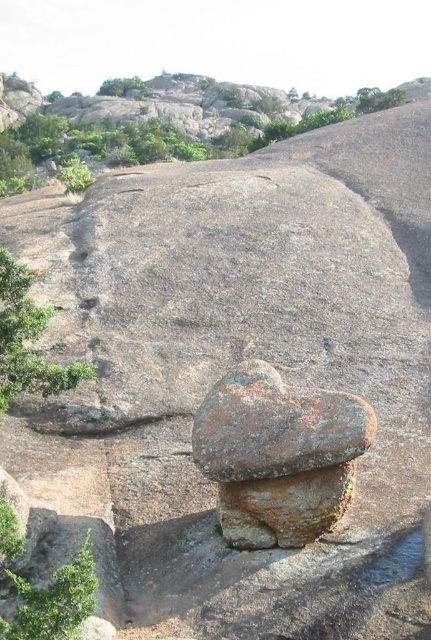
You are standing at a point in a rocky landscape and want to know how far you are from a specific point marked as point (x=224, y=538). Can you determine the distance?

The distance between you and point (x=224, y=538) is 21.88 feet.

You are planning to place a small garden ornament that requires a base wider than 1 meter. You see the rusty stone mushroom at center and the green leafy tree at lower left. Which object, if any, can provide a suitable base for the ornament?

The rusty stone mushroom at center might be wider than green leafy tree at lower left. Therefore, the rusty stone mushroom at center could potentially provide a suitable base for the ornament if its width meets or exceeds 1 meter.